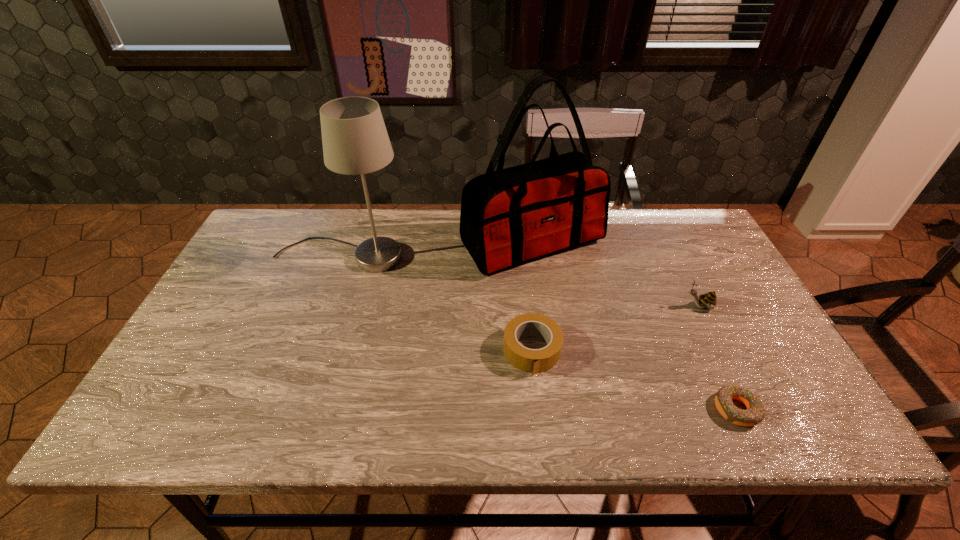
Locate an element on the screen. vacant region that satisfies the following two spatial constraints: 1. on the face of the snail; 2. at the edge of the duct tape is located at coordinates (721, 351).